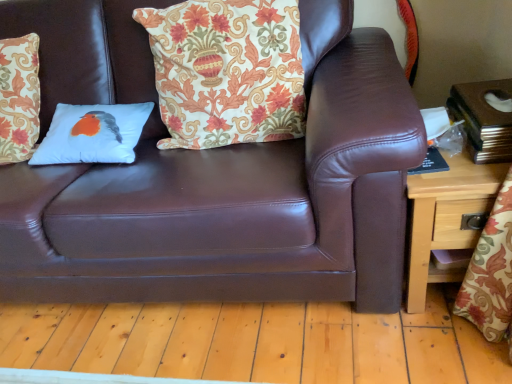
This screenshot has height=384, width=512. In order to click on brown leather couch at center in this screenshot , I will do `click(214, 177)`.

Image resolution: width=512 pixels, height=384 pixels. What do you see at coordinates (446, 218) in the screenshot?
I see `wooden side table at right` at bounding box center [446, 218].

Identify the location of white fabric pillow with bird design at center, which is the 1th pillow in right-to-left order. The height and width of the screenshot is (384, 512). (227, 71).

Measure the distance between brown leather couch at center and white fabric pillow with bird design at center, which is the 1th pillow in right-to-left order.

10.17 inches.

Is brown leather couch at center outside of white fabric pillow with bird design at center, which is the 1th pillow in right-to-left order?

That's correct, brown leather couch at center is outside of white fabric pillow with bird design at center, which is the 1th pillow in right-to-left order.

Between brown leather couch at center and white fabric pillow with bird design at center, which is the 1th pillow in right-to-left order, which one is positioned in front?

brown leather couch at center is in front.

Is brown leather couch at center in contact with white fabric pillow with bird design at center, which is the 1th pillow in right-to-left order?

No, brown leather couch at center is not making contact with white fabric pillow with bird design at center, which is the 1th pillow in right-to-left order.

Is wooden side table at right at the back of brown leather couch at center?

No, brown leather couch at center's orientation is not away from wooden side table at right.

Which object is thinner, brown leather couch at center or wooden side table at right?

wooden side table at right is thinner.

This screenshot has height=384, width=512. I want to click on studio couch located above the wooden side table at right (from a real-world perspective), so click(x=214, y=177).

From a real-world perspective, is brown leather couch at center physically above wooden side table at right?

Yes, from a real-world perspective, brown leather couch at center is over wooden side table at right

In terms of width, does brown leather couch at center look wider or thinner when compared to white matte pillow with bird design at center, which ranks as the first pillow in left-to-right order?

Clearly, brown leather couch at center has more width compared to white matte pillow with bird design at center, which ranks as the first pillow in left-to-right order.

Considering their positions, is brown leather couch at center located in front of or behind white matte pillow with bird design at center, which ranks as the 2th pillow in right-to-left order?

Clearly, brown leather couch at center is in front of white matte pillow with bird design at center, which ranks as the 2th pillow in right-to-left order.

Is brown leather couch at center touching white matte pillow with bird design at center, which ranks as the first pillow in left-to-right order?

No, brown leather couch at center is not next to white matte pillow with bird design at center, which ranks as the first pillow in left-to-right order.

Can white matte pillow with bird design at center, which ranks as the first pillow in left-to-right order, be found inside brown leather couch at center?

Yes, white matte pillow with bird design at center, which ranks as the first pillow in left-to-right order, is a part of brown leather couch at center.

Which of these two, white fabric pillow with bird design at center, which is the 1th pillow in right-to-left order, or wooden side table at right, is thinner?

With smaller width is white fabric pillow with bird design at center, which is the 1th pillow in right-to-left order.

Is white fabric pillow with bird design at center, the second pillow in the left-to-right sequence, oriented towards wooden side table at right?

No, white fabric pillow with bird design at center, the second pillow in the left-to-right sequence, is not turned towards wooden side table at right.

From a real-world perspective, is white fabric pillow with bird design at center, the second pillow in the left-to-right sequence, beneath wooden side table at right?

Actually, white fabric pillow with bird design at center, the second pillow in the left-to-right sequence, is physically above wooden side table at right in the real world.

Is wooden side table at right with brown leather couch at center?

No, wooden side table at right is not making contact with brown leather couch at center.

From the picture: How distant is wooden side table at right from brown leather couch at center?

wooden side table at right is 19.45 inches from brown leather couch at center.

Is wooden side table at right completely or partially outside of brown leather couch at center?

Yes, wooden side table at right is located beyond the bounds of brown leather couch at center.

What's the angular difference between wooden side table at right and brown leather couch at center's facing directions?

The facing directions of wooden side table at right and brown leather couch at center are 0.361 degrees apart.

Is white fabric pillow with bird design at center, the second pillow in the left-to-right sequence, with white matte pillow with bird design at center, which ranks as the first pillow in left-to-right order?

No, white fabric pillow with bird design at center, the second pillow in the left-to-right sequence, is not making contact with white matte pillow with bird design at center, which ranks as the first pillow in left-to-right order.

Is point (173, 86) positioned after point (126, 156)?

Yes.

Does white fabric pillow with bird design at center, the second pillow in the left-to-right sequence, have a greater height compared to white matte pillow with bird design at center, which ranks as the 2th pillow in right-to-left order?

Indeed, white fabric pillow with bird design at center, the second pillow in the left-to-right sequence, has a greater height compared to white matte pillow with bird design at center, which ranks as the 2th pillow in right-to-left order.

Is white fabric pillow with bird design at center, the second pillow in the left-to-right sequence, inside or outside of white matte pillow with bird design at center, which ranks as the first pillow in left-to-right order?

white fabric pillow with bird design at center, the second pillow in the left-to-right sequence, exists outside the volume of white matte pillow with bird design at center, which ranks as the first pillow in left-to-right order.

Based on the photo, is wooden side table at right situated inside white matte pillow with bird design at center, which ranks as the first pillow in left-to-right order, or outside?

wooden side table at right cannot be found inside white matte pillow with bird design at center, which ranks as the first pillow in left-to-right order.

Is wooden side table at right looking in the opposite direction of white matte pillow with bird design at center, which ranks as the 2th pillow in right-to-left order?

wooden side table at right is not turned away from white matte pillow with bird design at center, which ranks as the 2th pillow in right-to-left order.

Where is `the 1st pillow above when counting from the wooden side table at right (from the image's perspective)`? the 1st pillow above when counting from the wooden side table at right (from the image's perspective) is located at coordinates (93, 134).

Considering the relative sizes of wooden side table at right and white matte pillow with bird design at center, which ranks as the 2th pillow in right-to-left order, in the image provided, is wooden side table at right bigger than white matte pillow with bird design at center, which ranks as the 2th pillow in right-to-left order,?

Correct, wooden side table at right is larger in size than white matte pillow with bird design at center, which ranks as the 2th pillow in right-to-left order.

Find the location of a particular element. The width and height of the screenshot is (512, 384). studio couch lying below the white fabric pillow with bird design at center, the second pillow in the left-to-right sequence (from the image's perspective) is located at coordinates (214, 177).

Identify the location of table on the right of the brown leather couch at center. The width and height of the screenshot is (512, 384). (446, 218).

When comparing their distances from white matte pillow with bird design at center, which ranks as the 2th pillow in right-to-left order, does wooden side table at right or white fabric pillow with bird design at center, the second pillow in the left-to-right sequence, seem further?

Based on the image, wooden side table at right appears to be further to white matte pillow with bird design at center, which ranks as the 2th pillow in right-to-left order.

Estimate the real-world distances between objects in this image. Which object is closer to white fabric pillow with bird design at center, which is the 1th pillow in right-to-left order, wooden side table at right or white matte pillow with bird design at center, which ranks as the first pillow in left-to-right order?

white matte pillow with bird design at center, which ranks as the first pillow in left-to-right order, lies closer to white fabric pillow with bird design at center, which is the 1th pillow in right-to-left order, than the other object.

Consider the image. Considering their positions, is white matte pillow with bird design at center, which ranks as the first pillow in left-to-right order, positioned further to brown leather couch at center than wooden side table at right?

Based on the image, wooden side table at right appears to be further to brown leather couch at center.

Estimate the real-world distances between objects in this image. Which object is further from white matte pillow with bird design at center, which ranks as the 2th pillow in right-to-left order, brown leather couch at center or white fabric pillow with bird design at center, the second pillow in the left-to-right sequence?

brown leather couch at center lies further to white matte pillow with bird design at center, which ranks as the 2th pillow in right-to-left order, than the other object.

From the image, which object appears to be nearer to white fabric pillow with bird design at center, which is the 1th pillow in right-to-left order, white matte pillow with bird design at center, which ranks as the first pillow in left-to-right order, or wooden side table at right?

Among the two, white matte pillow with bird design at center, which ranks as the first pillow in left-to-right order, is located nearer to white fabric pillow with bird design at center, which is the 1th pillow in right-to-left order.

Based on their spatial positions, is white fabric pillow with bird design at center, the second pillow in the left-to-right sequence, or wooden side table at right closer to white matte pillow with bird design at center, which ranks as the first pillow in left-to-right order?

Based on the image, white fabric pillow with bird design at center, the second pillow in the left-to-right sequence, appears to be nearer to white matte pillow with bird design at center, which ranks as the first pillow in left-to-right order.

Based on their spatial positions, is white fabric pillow with bird design at center, which is the 1th pillow in right-to-left order, or white matte pillow with bird design at center, which ranks as the first pillow in left-to-right order, closer to brown leather couch at center?

white fabric pillow with bird design at center, which is the 1th pillow in right-to-left order.

When comparing their distances from brown leather couch at center, does wooden side table at right or white fabric pillow with bird design at center, which is the 1th pillow in right-to-left order, seem closer?

white fabric pillow with bird design at center, which is the 1th pillow in right-to-left order, is positioned closer to the anchor brown leather couch at center.

This screenshot has width=512, height=384. In order to click on pillow located between white matte pillow with bird design at center, which ranks as the 2th pillow in right-to-left order, and wooden side table at right in the left-right direction in this screenshot , I will do `click(227, 71)`.

Where is `pillow between brown leather couch at center and white matte pillow with bird design at center, which ranks as the first pillow in left-to-right order, in the front-back direction`? The image size is (512, 384). pillow between brown leather couch at center and white matte pillow with bird design at center, which ranks as the first pillow in left-to-right order, in the front-back direction is located at coordinates (227, 71).

You are a GUI agent. You are given a task and a screenshot of the screen. Output one action in this format:
    pyautogui.click(x=<x>, y=<y>)
    Task: Click on the pillow between brown leather couch at center and wooden side table at right
    The width and height of the screenshot is (512, 384).
    Given the screenshot: What is the action you would take?
    pyautogui.click(x=227, y=71)

Locate an element on the screen. studio couch between white matte pillow with bird design at center, which ranks as the first pillow in left-to-right order, and wooden side table at right from left to right is located at coordinates click(214, 177).